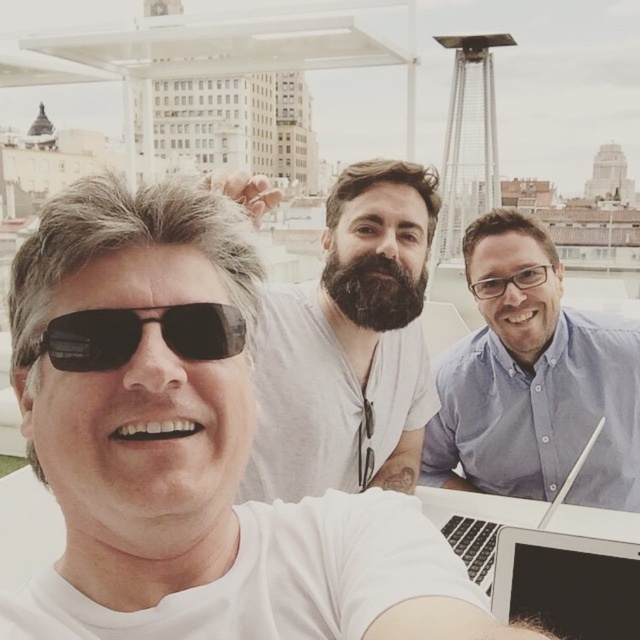
You are a photographer trying to capture a photo of the bearded man at center and the black matte sunglasses at center. Based on their positions, which object is closer to the camera?

The bearded man at center is closer to the camera because he is located above the black matte sunglasses at center, indicating a higher position in the visual plane.